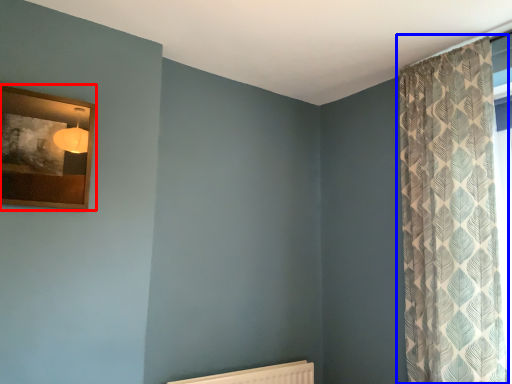
Question: Which of the following is the farthest to the observer, picture frame (highlighted by a red box) or curtain (highlighted by a blue box)?

Choices:
 (A) picture frame
 (B) curtain

Answer: (B)